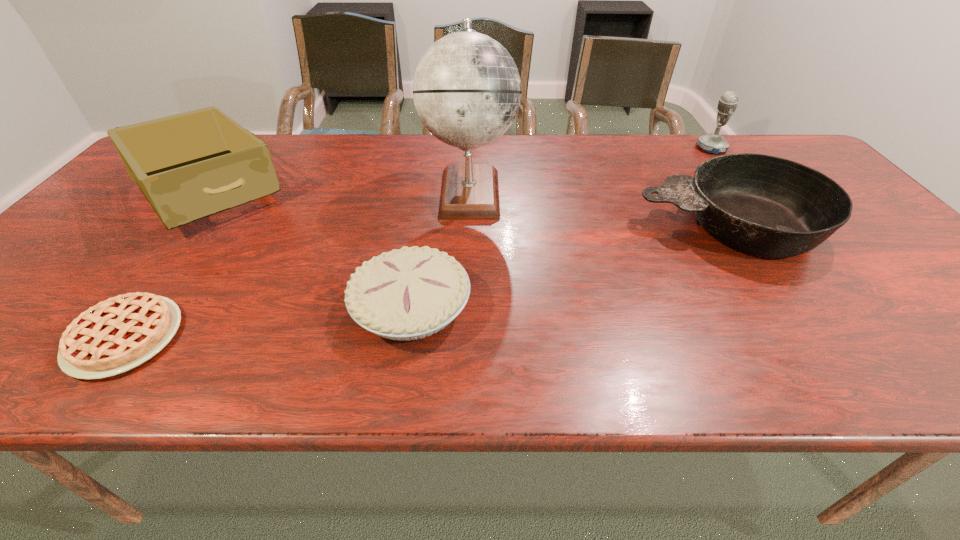
This screenshot has height=540, width=960. I want to click on vacant space located on the front-facing side of the microphone, so click(579, 148).

Where is `blank area located 0.070m on the front-facing side of the microphone`? The height and width of the screenshot is (540, 960). blank area located 0.070m on the front-facing side of the microphone is located at coordinates (674, 148).

The image size is (960, 540). I want to click on free region located on the front of the box, so click(x=121, y=298).

Locate an element on the screen. This screenshot has width=960, height=540. vacant space located 0.300m with the handle extending from the side of the frying pan is located at coordinates (517, 226).

Where is `vacant space located with the handle extending from the side of the frying pan`? The image size is (960, 540). vacant space located with the handle extending from the side of the frying pan is located at coordinates (577, 226).

Where is `vacant space situated with the handle extending from the side of the frying pan`? This screenshot has height=540, width=960. vacant space situated with the handle extending from the side of the frying pan is located at coordinates pyautogui.click(x=545, y=226).

The width and height of the screenshot is (960, 540). Identify the location of vacant space situated 0.200m on the right of the right pie. (567, 306).

Locate an element on the screen. free space located on the back of the left pie is located at coordinates (195, 241).

Where is `globe situated at the far edge`? The width and height of the screenshot is (960, 540). globe situated at the far edge is located at coordinates (467, 91).

Where is `microphone present at the far edge`? microphone present at the far edge is located at coordinates (712, 143).